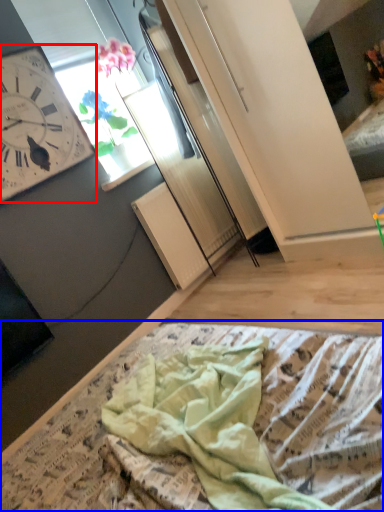
Question: Which of the following is the closest to the observer, wall clock (highlighted by a red box) or blanket (highlighted by a blue box)?

Choices:
 (A) wall clock
 (B) blanket

Answer: (B)